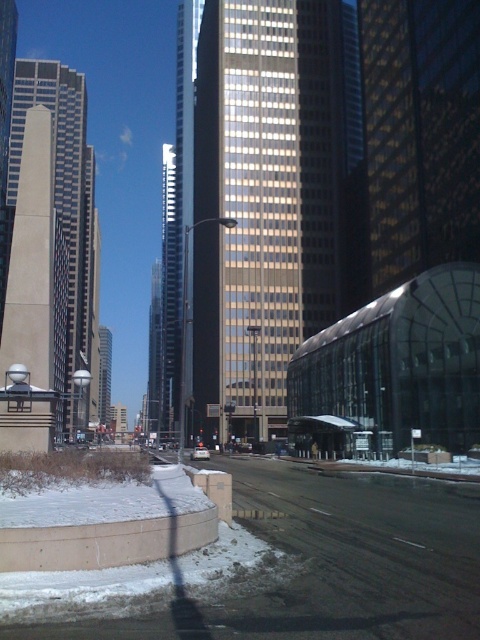
You are a delivery drone that needs to fly between the gold reflective glass skyscraper at center and the beige glass skyscraper at left. Your drone can only handle a maximum distance of 50 meters between waypoints. Can you safely navigate between these two skyscrapers without exceeding your maximum distance limit?

The gold reflective glass skyscraper at center and beige glass skyscraper at left are 40.24 meters apart from each other. Since 40.24 meters is less than the 50 meters maximum distance limit, the drone can safely navigate between them without exceeding the limit.

You are a city planner assessing the skyline. Which of the two skyscrapers, the gold reflective glass skyscraper at center or the beige glass skyscraper at left, would cast a longer shadow during midday in winter?

The gold reflective glass skyscraper at center is much taller than the beige glass skyscraper at left, so it would cast a longer shadow during midday in winter.